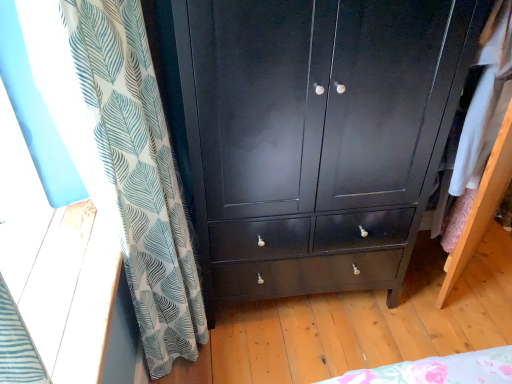
Identify the location of vacant space in between white leaf-patterned curtain at left and glossy black cabinet at center. (292, 349).